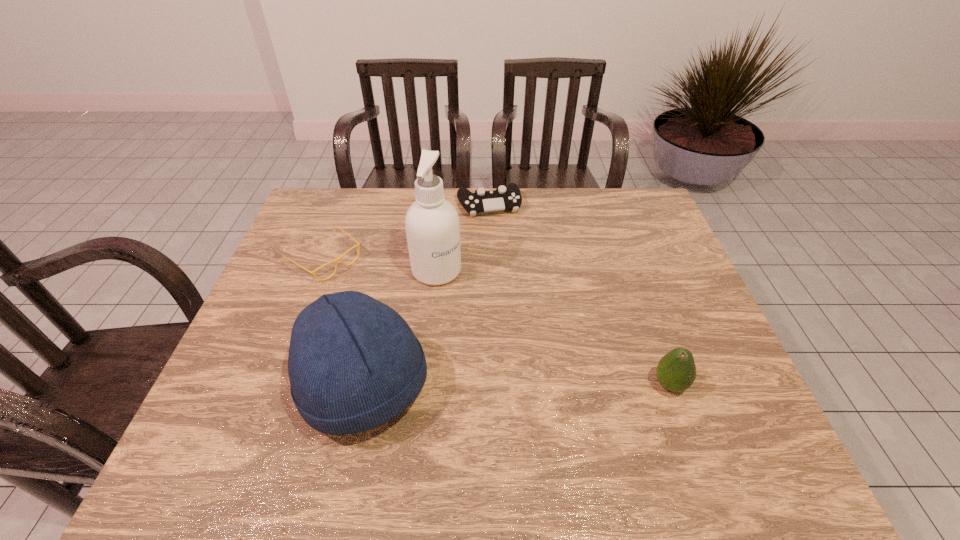
Where is `free point that satisfies the following two spatial constraints: 1. on the front side of the shortest object; 2. on the left side of the skullcap`? Image resolution: width=960 pixels, height=540 pixels. free point that satisfies the following two spatial constraints: 1. on the front side of the shortest object; 2. on the left side of the skullcap is located at coordinates (276, 387).

Find the location of a particular element. The height and width of the screenshot is (540, 960). vacant area in the image that satisfies the following two spatial constraints: 1. on the front side of the skullcap; 2. on the left side of the spectacles is located at coordinates (276, 387).

I want to click on vacant space that satisfies the following two spatial constraints: 1. on the front side of the third tallest object; 2. on the right side of the tallest object, so click(425, 384).

What are the coordinates of `vacant area that satisfies the following two spatial constraints: 1. on the back side of the tallest object; 2. on the left side of the skullcap` in the screenshot? It's located at (390, 271).